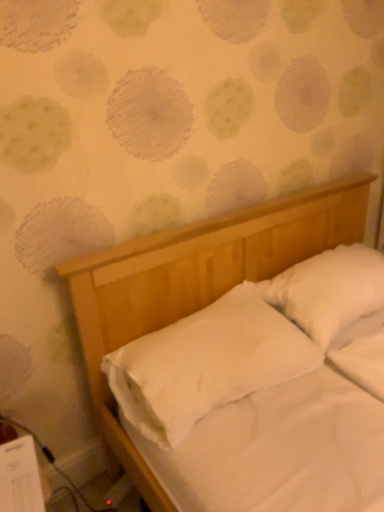
Describe the element at coordinates (206, 362) in the screenshot. This screenshot has width=384, height=512. I see `white smooth pillow at center, which is counted as the second pillow, starting from the right` at that location.

Measure the distance between white smooth pillow at center, which is counted as the second pillow, starting from the right, and camera.

The depth of white smooth pillow at center, which is counted as the second pillow, starting from the right, is 3.82 feet.

Where is `white smooth pillow at center, the first pillow in the left-to-right sequence`? This screenshot has width=384, height=512. white smooth pillow at center, the first pillow in the left-to-right sequence is located at coordinates (206, 362).

Image resolution: width=384 pixels, height=512 pixels. Find the location of `white soft pillow at upper right, placed as the 2th pillow when sorted from left to right`. white soft pillow at upper right, placed as the 2th pillow when sorted from left to right is located at coordinates (330, 292).

Describe the element at coordinates (330, 292) in the screenshot. I see `white soft pillow at upper right, placed as the 2th pillow when sorted from left to right` at that location.

This screenshot has height=512, width=384. I want to click on white smooth pillow at center, the first pillow in the left-to-right sequence, so click(x=206, y=362).

Looking at this image, can you confirm if white smooth pillow at center, which is counted as the second pillow, starting from the right, is positioned to the left of white soft pillow at upper right, the first pillow viewed from the right?

Correct, you'll find white smooth pillow at center, which is counted as the second pillow, starting from the right, to the left of white soft pillow at upper right, the first pillow viewed from the right.

Is white smooth pillow at center, the first pillow in the left-to-right sequence, in front of or behind white soft pillow at upper right, placed as the 2th pillow when sorted from left to right, in the image?

In the image, white smooth pillow at center, the first pillow in the left-to-right sequence, appears in front of white soft pillow at upper right, placed as the 2th pillow when sorted from left to right.

Is point (168, 333) less distant than point (306, 303)?

Yes, it is in front of point (306, 303).

From the image's perspective, would you say white smooth pillow at center, the first pillow in the left-to-right sequence, is shown under white soft pillow at upper right, the first pillow viewed from the right?

Yes, from the image's perspective, white smooth pillow at center, the first pillow in the left-to-right sequence, is beneath white soft pillow at upper right, the first pillow viewed from the right.

From a real-world perspective, which is physically below, white smooth pillow at center, the first pillow in the left-to-right sequence, or white soft pillow at upper right, the first pillow viewed from the right?

white smooth pillow at center, the first pillow in the left-to-right sequence.

Looking at their sizes, would you say white smooth pillow at center, which is counted as the second pillow, starting from the right, is wider or thinner than white soft pillow at upper right, the first pillow viewed from the right?

Clearly, white smooth pillow at center, which is counted as the second pillow, starting from the right, has more width compared to white soft pillow at upper right, the first pillow viewed from the right.

Can you confirm if white smooth pillow at center, which is counted as the second pillow, starting from the right, is shorter than white soft pillow at upper right, the first pillow viewed from the right?

Yes.

Is white smooth pillow at center, the first pillow in the left-to-right sequence, smaller than white soft pillow at upper right, the first pillow viewed from the right?

No, white smooth pillow at center, the first pillow in the left-to-right sequence, is not smaller than white soft pillow at upper right, the first pillow viewed from the right.

Could white soft pillow at upper right, the first pillow viewed from the right, be considered to be inside white smooth pillow at center, which is counted as the second pillow, starting from the right?

No, white soft pillow at upper right, the first pillow viewed from the right, is not a part of white smooth pillow at center, which is counted as the second pillow, starting from the right.

Is the surface of white smooth pillow at center, the first pillow in the left-to-right sequence, in direct contact with white soft pillow at upper right, placed as the 2th pillow when sorted from left to right?

No, white smooth pillow at center, the first pillow in the left-to-right sequence, is not with white soft pillow at upper right, placed as the 2th pillow when sorted from left to right.

Is white smooth pillow at center, the first pillow in the left-to-right sequence, facing away from white soft pillow at upper right, placed as the 2th pillow when sorted from left to right?

white smooth pillow at center, the first pillow in the left-to-right sequence, is not turned away from white soft pillow at upper right, placed as the 2th pillow when sorted from left to right.

Looking at this image, measure the distance between white smooth pillow at center, which is counted as the second pillow, starting from the right, and white soft pillow at upper right, the first pillow viewed from the right.

The distance of white smooth pillow at center, which is counted as the second pillow, starting from the right, from white soft pillow at upper right, the first pillow viewed from the right, is 29.20 centimeters.

You are a GUI agent. You are given a task and a screenshot of the screen. Output one action in this format:
    pyautogui.click(x=<x>, y=<y>)
    Task: Click on the pillow lying on the right of white smooth pillow at center, which is counted as the second pillow, starting from the right
    The height and width of the screenshot is (512, 384).
    Given the screenshot: What is the action you would take?
    pyautogui.click(x=330, y=292)

Is white soft pillow at upper right, placed as the 2th pillow when sorted from left to right, to the right of white smooth pillow at center, which is counted as the second pillow, starting from the right, from the viewer's perspective?

Yes, white soft pillow at upper right, placed as the 2th pillow when sorted from left to right, is to the right of white smooth pillow at center, which is counted as the second pillow, starting from the right.

Relative to white smooth pillow at center, the first pillow in the left-to-right sequence, is white soft pillow at upper right, placed as the 2th pillow when sorted from left to right, in front or behind?

In the image, white soft pillow at upper right, placed as the 2th pillow when sorted from left to right, appears behind white smooth pillow at center, the first pillow in the left-to-right sequence.

Considering the positions of points (323, 333) and (191, 421), is point (323, 333) farther from camera compared to point (191, 421)?

Yes, it is.

From the image's perspective, is white soft pillow at upper right, the first pillow viewed from the right, located above white smooth pillow at center, the first pillow in the left-to-right sequence?

Correct, white soft pillow at upper right, the first pillow viewed from the right, appears higher than white smooth pillow at center, the first pillow in the left-to-right sequence, in the image.

From a real-world perspective, which object rests below the other?

In real-world perspective, white smooth pillow at center, the first pillow in the left-to-right sequence, is lower.

Is white soft pillow at upper right, placed as the 2th pillow when sorted from left to right, wider or thinner than white smooth pillow at center, the first pillow in the left-to-right sequence?

white soft pillow at upper right, placed as the 2th pillow when sorted from left to right, is thinner than white smooth pillow at center, the first pillow in the left-to-right sequence.

From their relative heights in the image, would you say white soft pillow at upper right, the first pillow viewed from the right, is taller or shorter than white smooth pillow at center, which is counted as the second pillow, starting from the right?

In the image, white soft pillow at upper right, the first pillow viewed from the right, appears to be taller than white smooth pillow at center, which is counted as the second pillow, starting from the right.

Is white soft pillow at upper right, placed as the 2th pillow when sorted from left to right, bigger than white smooth pillow at center, which is counted as the second pillow, starting from the right?

Incorrect, white soft pillow at upper right, placed as the 2th pillow when sorted from left to right, is not larger than white smooth pillow at center, which is counted as the second pillow, starting from the right.

Is white soft pillow at upper right, the first pillow viewed from the right, located outside white smooth pillow at center, which is counted as the second pillow, starting from the right?

Yes, white soft pillow at upper right, the first pillow viewed from the right, is outside of white smooth pillow at center, which is counted as the second pillow, starting from the right.

Would you consider white soft pillow at upper right, placed as the 2th pillow when sorted from left to right, to be distant from white smooth pillow at center, the first pillow in the left-to-right sequence?

No, white soft pillow at upper right, placed as the 2th pillow when sorted from left to right, is not far away from white smooth pillow at center, the first pillow in the left-to-right sequence.

Based on the photo, is white soft pillow at upper right, the first pillow viewed from the right, looking in the opposite direction of white smooth pillow at center, which is counted as the second pillow, starting from the right?

white soft pillow at upper right, the first pillow viewed from the right, is not turned away from white smooth pillow at center, which is counted as the second pillow, starting from the right.

This screenshot has height=512, width=384. Find the location of `pillow below the white soft pillow at upper right, placed as the 2th pillow when sorted from left to right (from a real-world perspective)`. pillow below the white soft pillow at upper right, placed as the 2th pillow when sorted from left to right (from a real-world perspective) is located at coordinates (206, 362).

Identify the location of pillow to the right of white smooth pillow at center, which is counted as the second pillow, starting from the right. Image resolution: width=384 pixels, height=512 pixels. pyautogui.click(x=330, y=292).

Locate an element on the screen. The image size is (384, 512). pillow behind the white smooth pillow at center, which is counted as the second pillow, starting from the right is located at coordinates (330, 292).